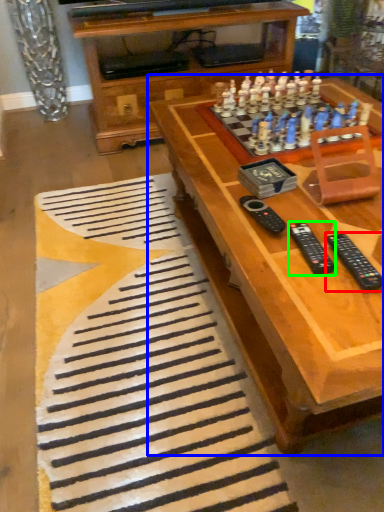
Question: Which object is positioned closest to remote (highlighted by a red box)? Select from table (highlighted by a blue box) and remote (highlighted by a green box).

Choices:
 (A) table
 (B) remote

Answer: (B)